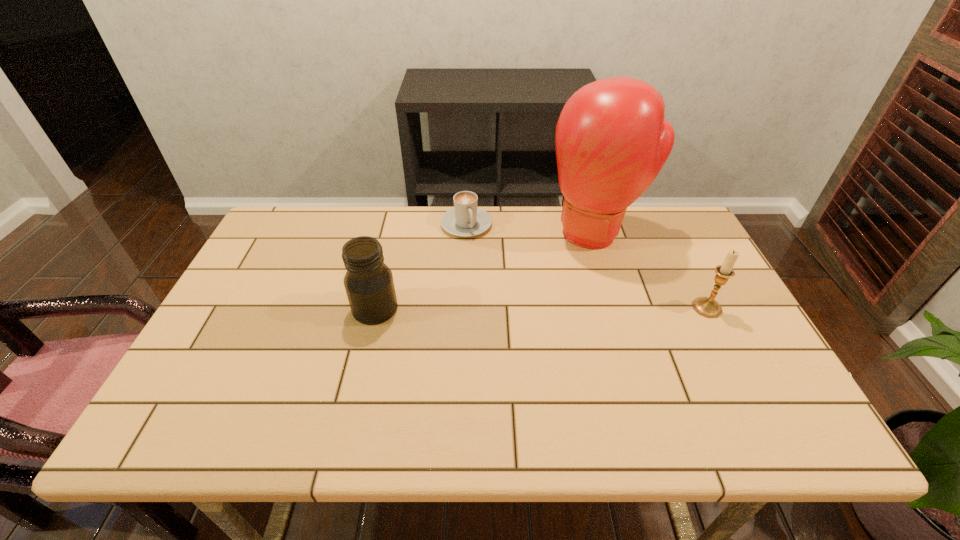
I want to click on vacant space located to the right of the shortest object, so click(x=492, y=280).

Locate an element on the screen. blank area located on the striking surface of the tallest object is located at coordinates (569, 281).

I want to click on vacant space situated on the striking surface of the tallest object, so click(x=559, y=302).

This screenshot has height=540, width=960. In order to click on vacant space located 0.100m on the striking surface of the tallest object in this screenshot , I will do `click(570, 279)`.

I want to click on cappuccino present at the far edge, so click(465, 219).

You are a GUI agent. You are given a task and a screenshot of the screen. Output one action in this format:
    pyautogui.click(x=<x>, y=<y>)
    Task: Click on the boxing glove located at the far edge
    
    Given the screenshot: What is the action you would take?
    pyautogui.click(x=611, y=140)

Find the location of a particular element. This screenshot has width=960, height=540. candle holder that is at the right edge is located at coordinates (708, 307).

Identify the location of boxing glove present at the right edge. This screenshot has height=540, width=960. (611, 140).

The image size is (960, 540). I want to click on object that is at the far right corner, so click(x=611, y=140).

You are a GUI agent. You are given a task and a screenshot of the screen. Output one action in this format:
    pyautogui.click(x=<x>, y=<y>)
    Task: Click on the vacant area at the far edge of the desktop
    This screenshot has width=960, height=540.
    Given the screenshot: What is the action you would take?
    pyautogui.click(x=440, y=206)